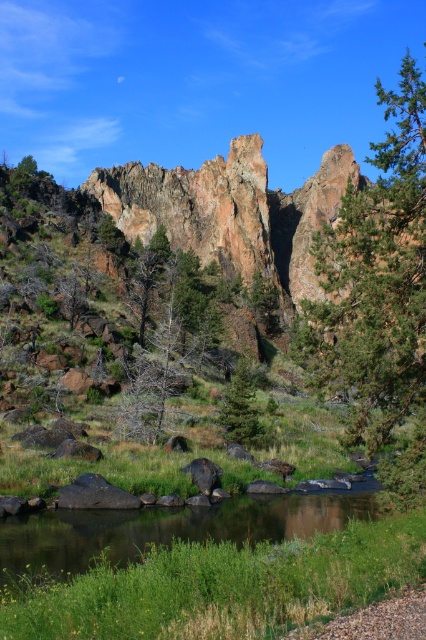
You are standing at the camera position looking at the serene natural landscape. There is a point marked at coordinates point (x=414, y=92). Can you estimate how far this point is from your current position?

The point (x=414, y=92) is 50.56 meters away from the camera position.

You are planning to set up a small tent for a picnic. The green grassy stream at lower center and the smooth gray rock at lower left are both potential spots. Which location would provide more space for your tent?

The green grassy stream at lower center is larger in size than the smooth gray rock at lower left, so it would provide more space for setting up the tent.